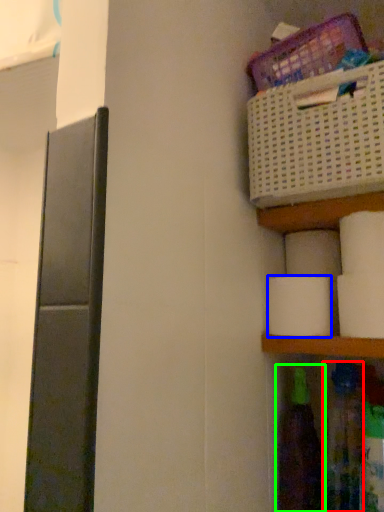
Question: Which is nearer to the bottle (highlighted by a red box)? toilet paper (highlighted by a blue box) or bottle (highlighted by a green box).

Choices:
 (A) toilet paper
 (B) bottle

Answer: (B)